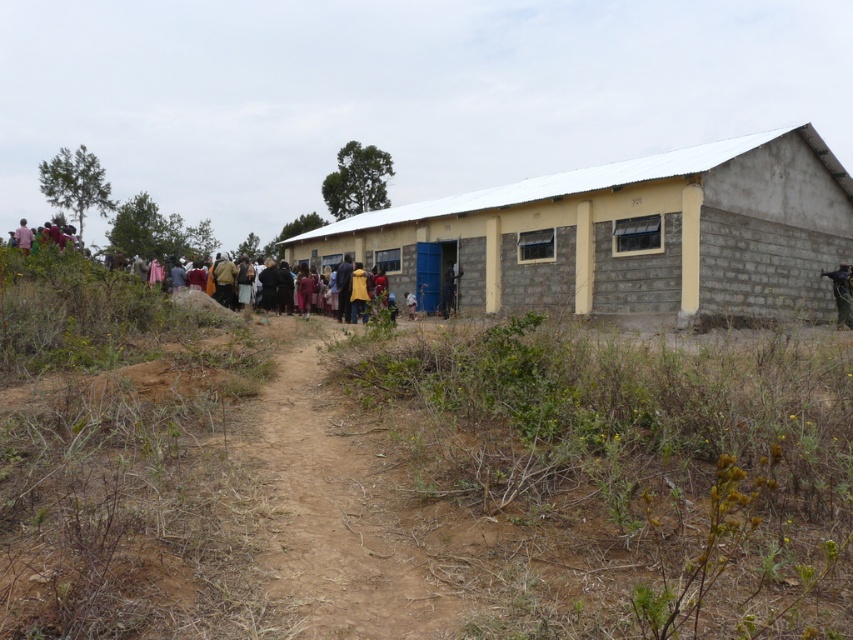
Who is more distant from viewer, (x=746, y=529) or (x=408, y=625)?

Positioned behind is point (x=746, y=529).

Is point (354, 548) positioned before point (271, 554)?

No, it is not.

Identify the location of brown dirt field at center. (442, 492).

Can you confirm if brown dirt field at center is positioned to the right of gray concrete building at center?

Yes, brown dirt field at center is to the right of gray concrete building at center.

Is point (674, 516) closer to camera compared to point (637, 308)?

Yes, it is in front of point (637, 308).

The height and width of the screenshot is (640, 853). Identify the location of brown dirt field at center. (442, 492).

This screenshot has width=853, height=640. What do you see at coordinates (625, 234) in the screenshot?
I see `gray concrete building at center` at bounding box center [625, 234].

Does gray concrete building at center lie behind brown dirt track at center?

Yes, it is behind brown dirt track at center.

Consider the image. Who is more forward, (834, 253) or (369, 552)?

Point (369, 552)

The width and height of the screenshot is (853, 640). What are the coordinates of `gray concrete building at center` in the screenshot? It's located at pyautogui.click(x=625, y=234).